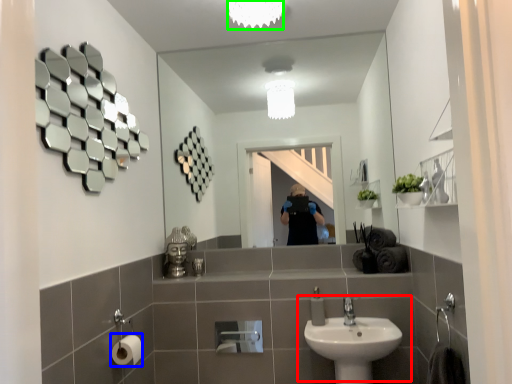
Question: Based on their relative distances, which object is nearer to sink (highlighted by a red box)? Choose from toilet paper (highlighted by a blue box) and light fixture (highlighted by a green box).

Choices:
 (A) toilet paper
 (B) light fixture

Answer: (A)